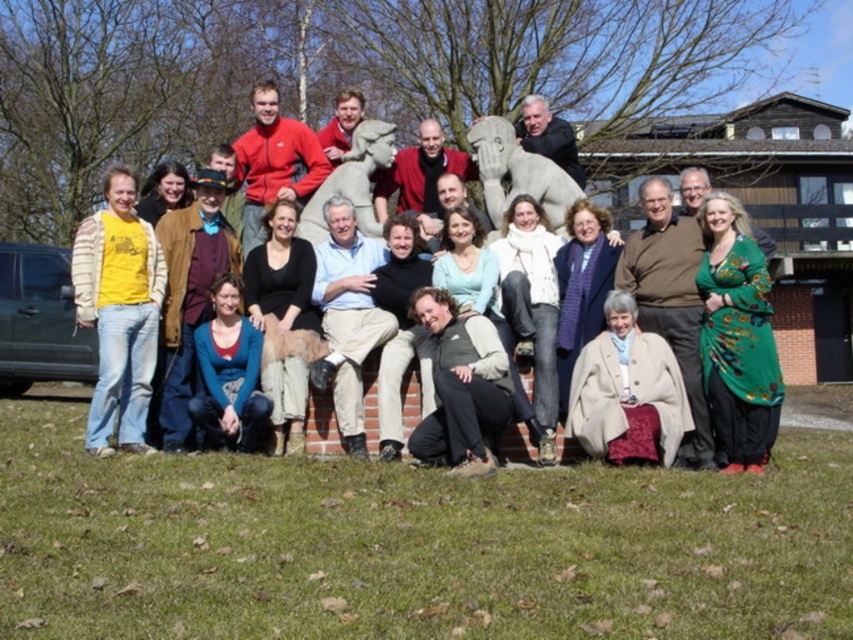
Does matte stone statues at center have a greater width compared to gray stone statue at center?

Correct, the width of matte stone statues at center exceeds that of gray stone statue at center.

Does matte stone statues at center have a larger size compared to gray stone statue at center?

Correct, matte stone statues at center is larger in size than gray stone statue at center.

Who is more forward, (664,182) or (556,212)?

Point (664,182)

Locate an element on the screen. The image size is (853, 640). matte stone statues at center is located at coordinates (670, 276).

Is green fuzzy vest at center thinner than matte red jacket at center?

Correct, green fuzzy vest at center's width is less than matte red jacket at center's.

Can you confirm if green fuzzy vest at center is wider than matte red jacket at center?

In fact, green fuzzy vest at center might be narrower than matte red jacket at center.

Who is more forward, (x=462, y=442) or (x=288, y=188)?

Positioned in front is point (x=462, y=442).

Find the location of a particular element. green fuzzy vest at center is located at coordinates (460, 387).

Between point (415, 218) and point (753, 419), which one is positioned behind?

Point (415, 218)

Does matte stone statues at center have a larger size compared to green silk dress at lower right?

Correct, matte stone statues at center is larger in size than green silk dress at lower right.

At what (x,y) coordinates should I click in order to perform the action: click on matte stone statues at center. Please return your answer as a coordinate pair (x, y). This screenshot has height=640, width=853. Looking at the image, I should click on (670, 276).